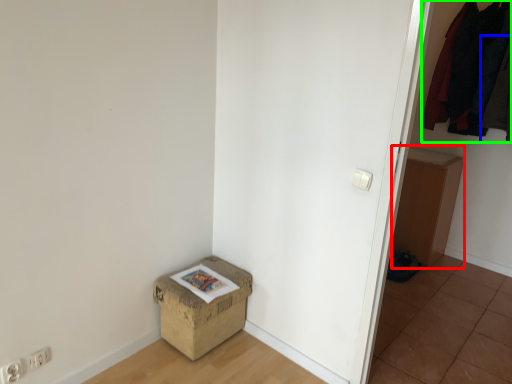
Question: Estimate the real-world distances between objects in this image. Which object is closer to cardboard box (highlighted by a red box), clothing (highlighted by a blue box) or clothing (highlighted by a green box)?

Choices:
 (A) clothing
 (B) clothing

Answer: (B)